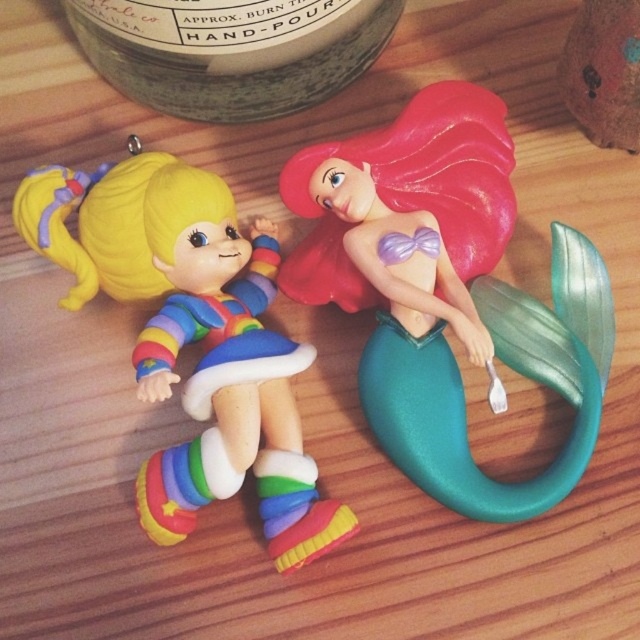
Question: Considering the relative positions of shiny plastic mermaid at center and green matte jar at upper center in the image provided, where is shiny plastic mermaid at center located with respect to green matte jar at upper center?

Choices:
 (A) right
 (B) left

Answer: (A)

Question: Where is rainbow plastic doll at left located in relation to green matte jar at upper center in the image?

Choices:
 (A) below
 (B) above

Answer: (A)

Question: Which of the following is the farthest from the observer?

Choices:
 (A) rainbow plastic doll at left
 (B) green matte jar at upper center

Answer: (B)

Question: Which point is farther to the camera?

Choices:
 (A) matte brown wooden toy at upper right
 (B) green matte jar at upper center

Answer: (B)

Question: Considering the relative positions of shiny plastic mermaid at center and matte brown wooden toy at upper right in the image provided, where is shiny plastic mermaid at center located with respect to matte brown wooden toy at upper right?

Choices:
 (A) right
 (B) left

Answer: (B)

Question: Estimate the real-world distances between objects in this image. Which object is farther from the matte brown wooden toy at upper right?

Choices:
 (A) rainbow plastic doll at left
 (B) shiny plastic mermaid at center

Answer: (A)